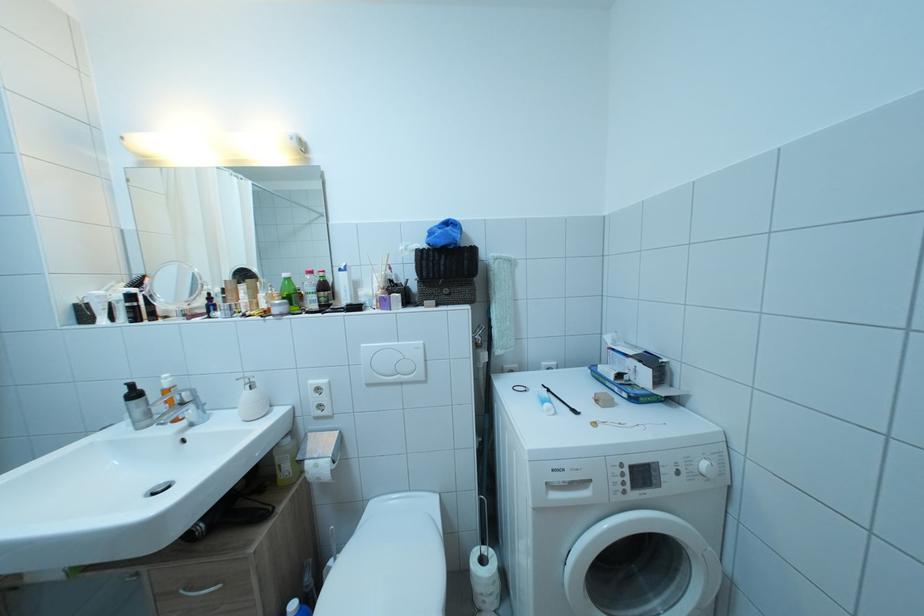
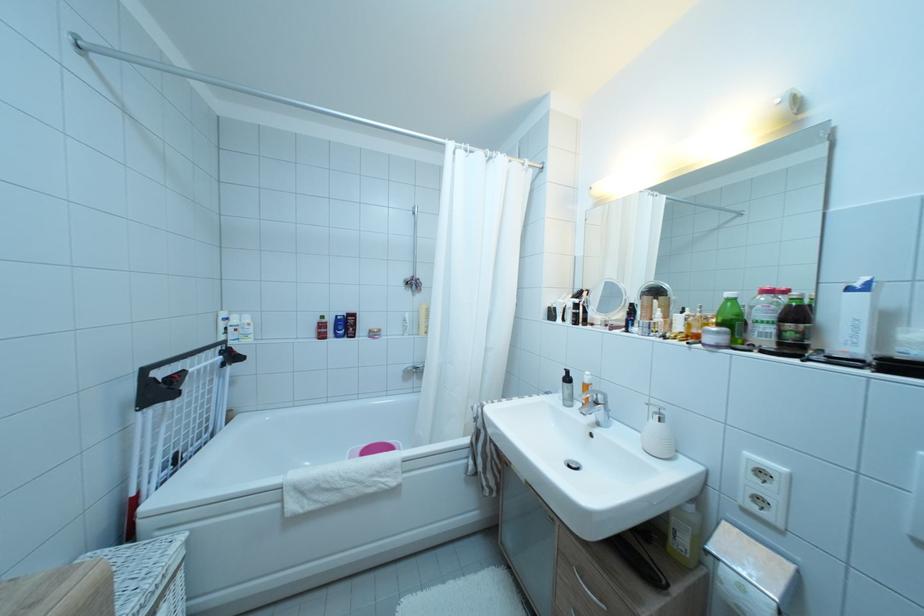
In the second image, find the point that corresponds to pixel 161 400 in the first image.

(585, 390)